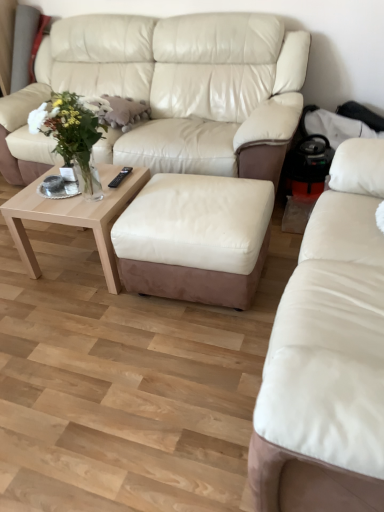
Describe the element at coordinates (195, 238) in the screenshot. I see `white leather ottoman at center` at that location.

The width and height of the screenshot is (384, 512). In order to click on light wood/texture coffee table at lower center in this screenshot , I will do `click(74, 216)`.

In order to face leather studio couch at center, which is the 2th studio couch from back to front, should I rotate leftwards or rightwards?

Rotate your view right by about 20.721°.

Where is `beige leather couch at upper center, the 1th studio couch viewed from the back`? The image size is (384, 512). beige leather couch at upper center, the 1th studio couch viewed from the back is located at coordinates (171, 91).

This screenshot has height=512, width=384. I want to click on translucent glass vase at center, so click(x=73, y=131).

Find the location of a particular element. white leather ottoman at center is located at coordinates (195, 238).

Which object is closer to the camera taking this photo, leather studio couch at center, which is the 2th studio couch from back to front, or white leather ottoman at center?

leather studio couch at center, which is the 2th studio couch from back to front.

The width and height of the screenshot is (384, 512). I want to click on stool lying above the leather studio couch at center, placed as the first studio couch when sorted from front to back (from the image's perspective), so click(195, 238).

Does leather studio couch at center, placed as the first studio couch when sorted from front to back, have a greater width compared to white leather ottoman at center?

Incorrect, the width of leather studio couch at center, placed as the first studio couch when sorted from front to back, does not surpass that of white leather ottoman at center.

How many degrees apart are the facing directions of leather studio couch at center, which is the 2th studio couch from back to front, and white leather ottoman at center?

The angular difference between leather studio couch at center, which is the 2th studio couch from back to front, and white leather ottoman at center is 93.1 degrees.

Is point (162, 217) closer or farther from the camera than point (251, 51)?

Point (162, 217) appears to be closer to the viewer than point (251, 51).

Considering their positions, is white leather ottoman at center located in front of or behind beige leather couch at upper center, the 1th studio couch viewed from the back?

In the image, white leather ottoman at center appears in front of beige leather couch at upper center, the 1th studio couch viewed from the back.

From a real-world perspective, does white leather ottoman at center sit lower than beige leather couch at upper center, the 1th studio couch viewed from the back?

Yes, from a real-world perspective, white leather ottoman at center is beneath beige leather couch at upper center, the 1th studio couch viewed from the back.

In the scene shown: From the image's perspective, is white leather ottoman at center located above beige leather couch at upper center, which ranks as the second studio couch in front-to-back order?

No, from the image's perspective, white leather ottoman at center is not above beige leather couch at upper center, which ranks as the second studio couch in front-to-back order.

From the image's perspective, does light wood/texture coffee table at lower center appear lower than leather studio couch at center, which is the 2th studio couch from back to front?

No, from the image's perspective, light wood/texture coffee table at lower center is not below leather studio couch at center, which is the 2th studio couch from back to front.

Consider the image. From a real-world perspective, is light wood/texture coffee table at lower center physically located above or below leather studio couch at center, placed as the first studio couch when sorted from front to back?

Clearly, from a real-world perspective, light wood/texture coffee table at lower center is below leather studio couch at center, placed as the first studio couch when sorted from front to back.

How far apart are light wood/texture coffee table at lower center and leather studio couch at center, which is the 2th studio couch from back to front?

3.76 feet.

Is there a large distance between leather studio couch at center, placed as the first studio couch when sorted from front to back, and light wood/texture coffee table at lower center?

Yes, leather studio couch at center, placed as the first studio couch when sorted from front to back, is far from light wood/texture coffee table at lower center.

Can you confirm if leather studio couch at center, which is the 2th studio couch from back to front, is bigger than light wood/texture coffee table at lower center?

Indeed, leather studio couch at center, which is the 2th studio couch from back to front, has a larger size compared to light wood/texture coffee table at lower center.

Looking at their sizes, would you say leather studio couch at center, which is the 2th studio couch from back to front, is wider or thinner than light wood/texture coffee table at lower center?

Clearly, leather studio couch at center, which is the 2th studio couch from back to front, has less width compared to light wood/texture coffee table at lower center.

At what (x,y) coordinates should I click in order to perform the action: click on studio couch below the light wood/texture coffee table at lower center (from the image's perspective). Please return your answer as a coordinate pair (x, y). The image size is (384, 512). Looking at the image, I should click on (329, 345).

Does beige leather couch at upper center, which ranks as the second studio couch in front-to-back order, have a lesser width compared to light wood/texture coffee table at lower center?

No.

Find the location of a particular element. This screenshot has height=512, width=384. coffee table below the beige leather couch at upper center, the 1th studio couch viewed from the back (from the image's perspective) is located at coordinates (74, 216).

Is beige leather couch at upper center, which ranks as the second studio couch in front-to-back order, not inside light wood/texture coffee table at lower center?

Yes, beige leather couch at upper center, which ranks as the second studio couch in front-to-back order, is located beyond the bounds of light wood/texture coffee table at lower center.

Is beige leather couch at upper center, which ranks as the second studio couch in front-to-back order, aimed at light wood/texture coffee table at lower center?

Yes, beige leather couch at upper center, which ranks as the second studio couch in front-to-back order, is turned towards light wood/texture coffee table at lower center.

Is white leather ottoman at center aimed at light wood/texture coffee table at lower center?

No.

Considering the positions of points (181, 211) and (97, 221), is point (181, 211) closer to camera compared to point (97, 221)?

Yes.

Is white leather ottoman at center situated inside light wood/texture coffee table at lower center or outside?

white leather ottoman at center is outside light wood/texture coffee table at lower center.

Between white leather ottoman at center and light wood/texture coffee table at lower center, which one has less height?

With less height is light wood/texture coffee table at lower center.

Which object is further away from the camera taking this photo, beige leather couch at upper center, which ranks as the second studio couch in front-to-back order, or leather studio couch at center, which is the 2th studio couch from back to front?

beige leather couch at upper center, which ranks as the second studio couch in front-to-back order, is more distant.

How many degrees apart are the facing directions of beige leather couch at upper center, which ranks as the second studio couch in front-to-back order, and leather studio couch at center, which is the 2th studio couch from back to front?

90.3 degrees.

Find the location of a particular element. studio couch on the right of beige leather couch at upper center, which ranks as the second studio couch in front-to-back order is located at coordinates (329, 345).

From a real-world perspective, which is physically above, beige leather couch at upper center, the 1th studio couch viewed from the back, or leather studio couch at center, placed as the first studio couch when sorted from front to back?

leather studio couch at center, placed as the first studio couch when sorted from front to back, from a real-world perspective.

This screenshot has width=384, height=512. Identify the location of stool that is behind the leather studio couch at center, placed as the first studio couch when sorted from front to back. (195, 238).

Where is `stool that appears below the beige leather couch at upper center, which ranks as the second studio couch in front-to-back order (from the image's perspective)`? The image size is (384, 512). stool that appears below the beige leather couch at upper center, which ranks as the second studio couch in front-to-back order (from the image's perspective) is located at coordinates (195, 238).

Based on their spatial positions, is white leather ottoman at center or leather studio couch at center, placed as the first studio couch when sorted from front to back, closer to beige leather couch at upper center, the 1th studio couch viewed from the back?

Based on the image, white leather ottoman at center appears to be nearer to beige leather couch at upper center, the 1th studio couch viewed from the back.

When comparing their distances from white leather ottoman at center, does leather studio couch at center, placed as the first studio couch when sorted from front to back, or beige leather couch at upper center, which ranks as the second studio couch in front-to-back order, seem further?

beige leather couch at upper center, which ranks as the second studio couch in front-to-back order, lies further to white leather ottoman at center than the other object.

Based on their spatial positions, is beige leather couch at upper center, which ranks as the second studio couch in front-to-back order, or white leather ottoman at center closer to light wood/texture coffee table at lower center?

Based on the image, white leather ottoman at center appears to be nearer to light wood/texture coffee table at lower center.

When comparing their distances from translucent glass vase at center, does beige leather couch at upper center, the 1th studio couch viewed from the back, or light wood/texture coffee table at lower center seem further?

Among the two, beige leather couch at upper center, the 1th studio couch viewed from the back, is located further to translucent glass vase at center.

Considering their positions, is light wood/texture coffee table at lower center positioned further to leather studio couch at center, which is the 2th studio couch from back to front, than white leather ottoman at center?

light wood/texture coffee table at lower center.

Which object lies nearer to the anchor point beige leather couch at upper center, which ranks as the second studio couch in front-to-back order, light wood/texture coffee table at lower center or white leather ottoman at center?

light wood/texture coffee table at lower center is closer to beige leather couch at upper center, which ranks as the second studio couch in front-to-back order.

Considering their positions, is leather studio couch at center, which is the 2th studio couch from back to front, positioned closer to beige leather couch at upper center, the 1th studio couch viewed from the back, than white leather ottoman at center?

white leather ottoman at center is positioned closer to the anchor beige leather couch at upper center, the 1th studio couch viewed from the back.

Estimate the real-world distances between objects in this image. Which object is further from light wood/texture coffee table at lower center, white leather ottoman at center or translucent glass vase at center?

white leather ottoman at center is positioned further to the anchor light wood/texture coffee table at lower center.

The height and width of the screenshot is (512, 384). Identify the location of coffee table between beige leather couch at upper center, which ranks as the second studio couch in front-to-back order, and white leather ottoman at center in the up-down direction. (74, 216).

I want to click on floral arrangement between light wood/texture coffee table at lower center and white leather ottoman at center in the horizontal direction, so click(73, 131).

You are a GUI agent. You are given a task and a screenshot of the screen. Output one action in this format:
    pyautogui.click(x=<x>, y=<y>)
    Task: Click on the floral arrangement between beige leather couch at upper center, the 1th studio couch viewed from the back, and white leather ottoman at center vertically
    Image resolution: width=384 pixels, height=512 pixels.
    Given the screenshot: What is the action you would take?
    pyautogui.click(x=73, y=131)

This screenshot has width=384, height=512. I want to click on floral arrangement that lies between beige leather couch at upper center, the 1th studio couch viewed from the back, and light wood/texture coffee table at lower center from top to bottom, so click(x=73, y=131).